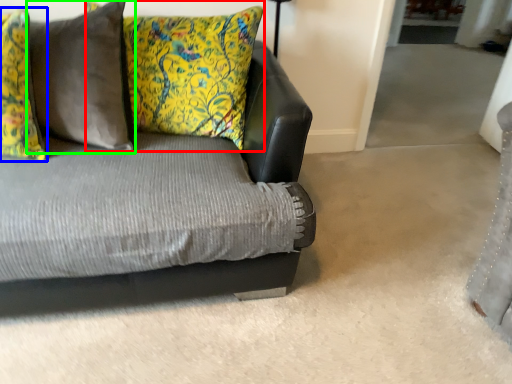
Question: Based on their relative distances, which object is farther from pillow (highlighted by a red box)? Choose from pillow (highlighted by a blue box) and pillow (highlighted by a green box).

Choices:
 (A) pillow
 (B) pillow

Answer: (A)